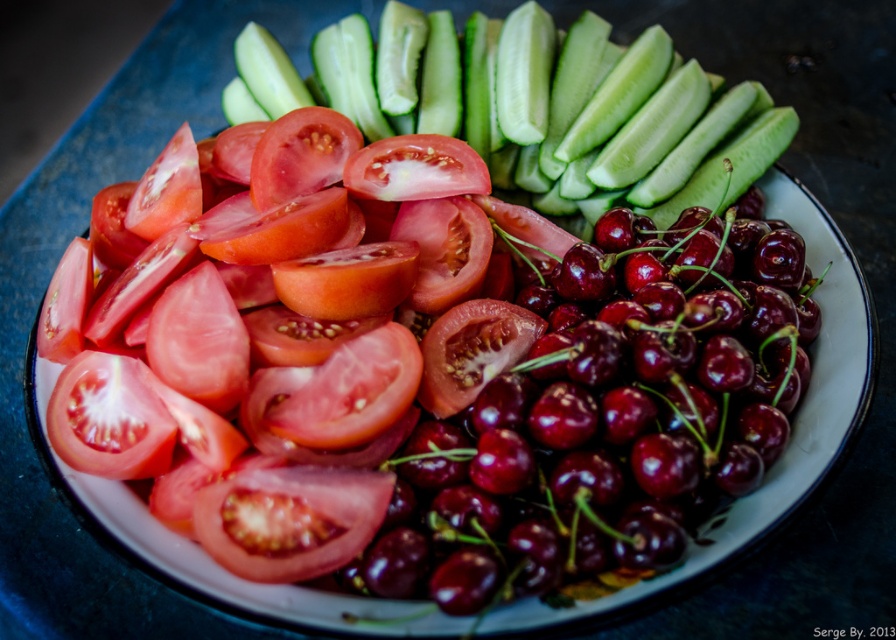
Is shiny red tomato at center to the right of shiny red cherry at center from the viewer's perspective?

No, shiny red tomato at center is not to the right of shiny red cherry at center.

Find the location of a particular element. This screenshot has height=640, width=896. shiny red tomato at center is located at coordinates (289, 348).

You are a GUI agent. You are given a task and a screenshot of the screen. Output one action in this format:
    pyautogui.click(x=<x>, y=<y>)
    Task: Click on the shiny red tomato at center
    The width and height of the screenshot is (896, 640).
    Given the screenshot: What is the action you would take?
    pyautogui.click(x=289, y=348)

Is shiny red tomato at center to the right of green smooth cucumber at upper center from the viewer's perspective?

In fact, shiny red tomato at center is to the left of green smooth cucumber at upper center.

Who is taller, shiny red tomato at center or green smooth cucumber at upper center?

Standing taller between the two is shiny red tomato at center.

Is point (375, 182) more distant than point (278, 92)?

That is False.

Locate an element on the screen. shiny red tomato at center is located at coordinates 289,348.

Can you confirm if shiny red cherry at center is positioned above green smooth cucumber at upper center?

No.

Is shiny red cherry at center below green smooth cucumber at upper center?

Correct, shiny red cherry at center is located below green smooth cucumber at upper center.

The image size is (896, 640). Describe the element at coordinates (599, 412) in the screenshot. I see `shiny red cherry at center` at that location.

What are the coordinates of `shiny red cherry at center` in the screenshot? It's located at (599, 412).